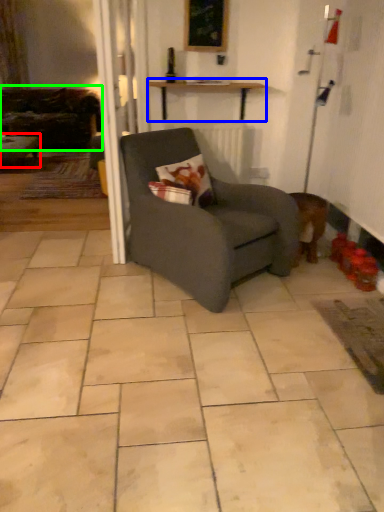
Question: Considering the real-world distances, which object is farthest from table (highlighted by a red box)? table (highlighted by a blue box) or studio couch (highlighted by a green box)?

Choices:
 (A) table
 (B) studio couch

Answer: (A)